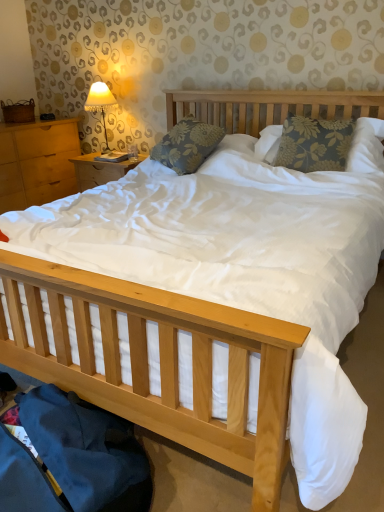
Question: Considering the positions of floral fabric pillow at center, placed as the second pillow when sorted from left to right, and floral fabric pillow at center, the second pillow from the right, in the image, is floral fabric pillow at center, placed as the second pillow when sorted from left to right, wider or thinner than floral fabric pillow at center, the second pillow from the right,?

Choices:
 (A) thin
 (B) wide

Answer: (A)

Question: From a real-world perspective, is floral fabric pillow at center, placed as the second pillow when sorted from left to right, physically located above or below floral fabric pillow at center, the second pillow from the right?

Choices:
 (A) below
 (B) above

Answer: (B)

Question: Which of these objects is positioned farthest from the matte fabric lampshade at upper left?

Choices:
 (A) light brown wood at left
 (B) floral fabric pillow at center, placed as the second pillow when sorted from left to right
 (C) floral fabric pillow at center, the second pillow from the right

Answer: (B)

Question: Which of these objects is positioned closest to the floral fabric pillow at center, placed as the second pillow when sorted from left to right?

Choices:
 (A) matte fabric lampshade at upper left
 (B) floral fabric pillow at center, which ranks as the 1th pillow in left-to-right order
 (C) light brown wood at left

Answer: (B)